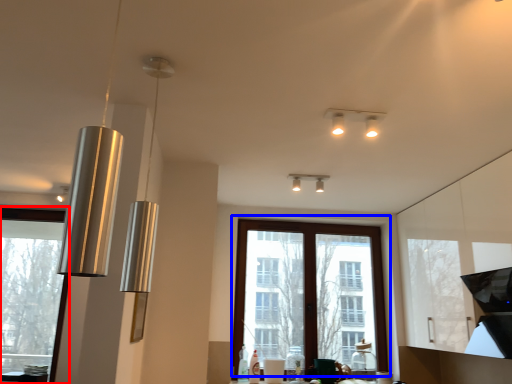
Question: Which of the following is the closest to the observer, window (highlighted by a red box) or window (highlighted by a blue box)?

Choices:
 (A) window
 (B) window

Answer: (A)